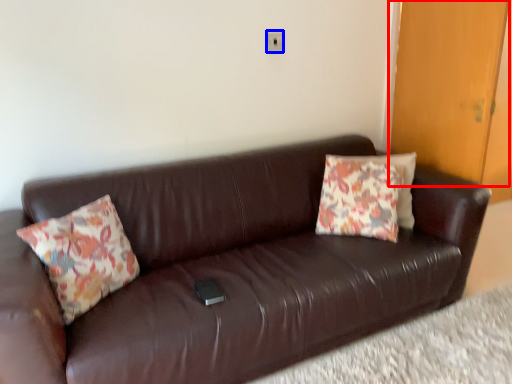
Question: Which object is closer to the camera taking this photo, door (highlighted by a red box) or electric outlet (highlighted by a blue box)?

Choices:
 (A) door
 (B) electric outlet

Answer: (A)